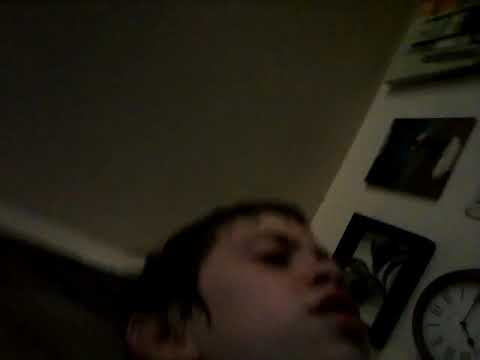
You are a GUI agent. You are given a task and a screenshot of the screen. Output one action in this format:
    pyautogui.click(x=<x>, y=<y>)
    Task: Click on the picture frame
    Image resolution: width=480 pixels, height=360 pixels.
    Given the screenshot: What is the action you would take?
    pyautogui.click(x=394, y=232), pyautogui.click(x=408, y=188)